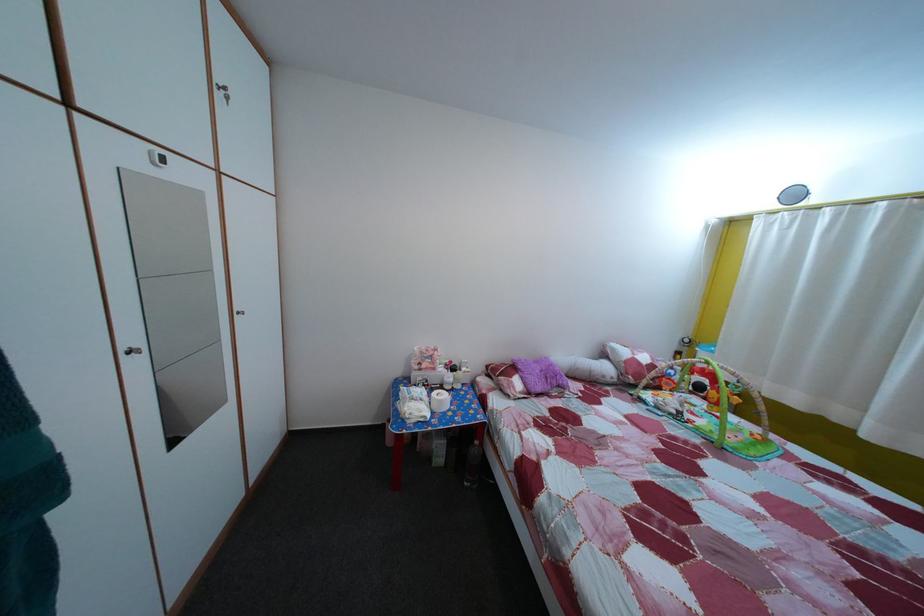
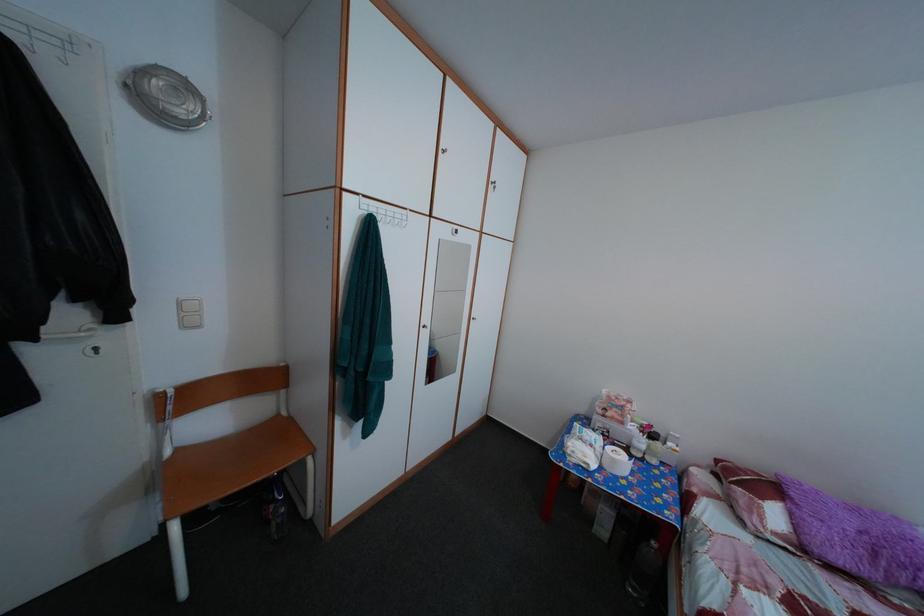
Question: The camera is either moving clockwise (left) or counter-clockwise (right) around the object. The first image is from the beginning of the video and the second image is from the end. Is the camera moving left or right when shooting the video?

Choices:
 (A) Left
 (B) Right

Answer: (B)